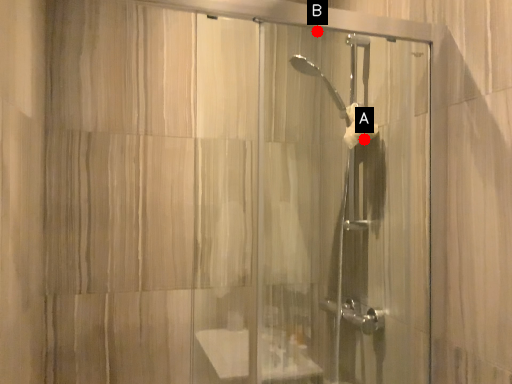
Question: Two points are circled on the image, labeled by A and B beside each circle. Which point is further to the camera?

Choices:
 (A) A is further
 (B) B is further

Answer: (B)